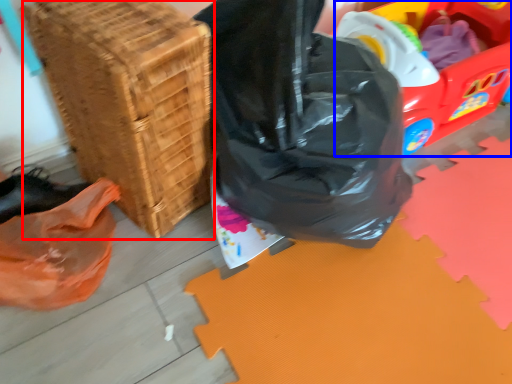
Question: Which point is further to the camera, basket (highlighted by a red box) or wagon (highlighted by a blue box)?

Choices:
 (A) basket
 (B) wagon

Answer: (B)